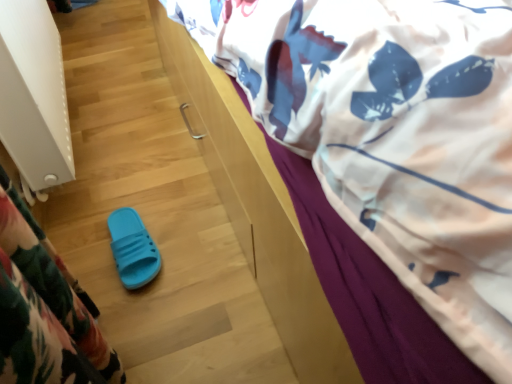
Question: Considering their positions, is white textured radiator at left located in front of or behind white printed fabric at upper right?

Choices:
 (A) behind
 (B) front

Answer: (A)

Question: Considering the positions of point (32, 170) and point (455, 243), is point (32, 170) closer or farther from the camera than point (455, 243)?

Choices:
 (A) farther
 (B) closer

Answer: (A)

Question: Estimate the real-world distances between objects in this image. Which object is farther from the white printed fabric at upper right?

Choices:
 (A) white textured radiator at left
 (B) blue rubber slipper at lower left

Answer: (B)

Question: Estimate the real-world distances between objects in this image. Which object is farther from the white textured radiator at left?

Choices:
 (A) white printed fabric at upper right
 (B) blue rubber slipper at lower left

Answer: (A)